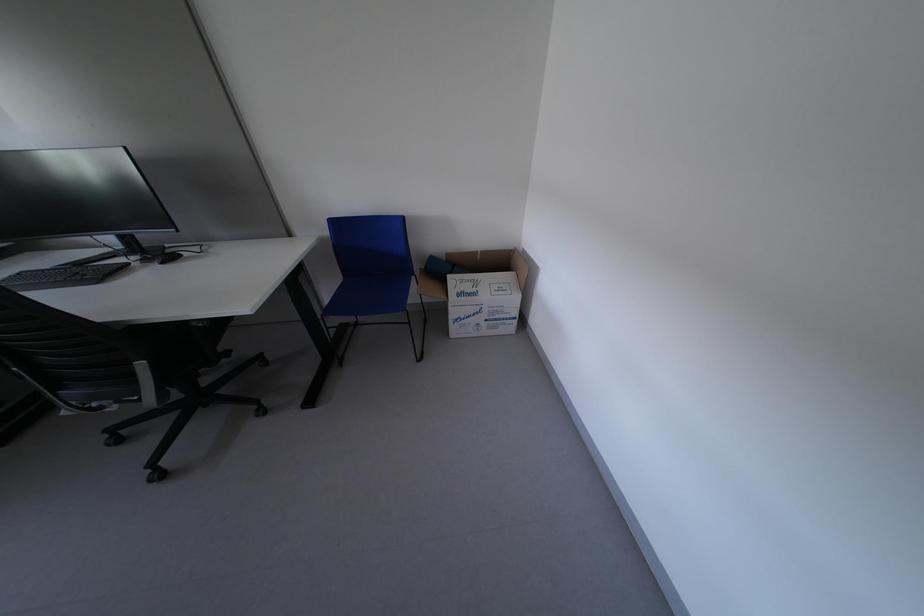
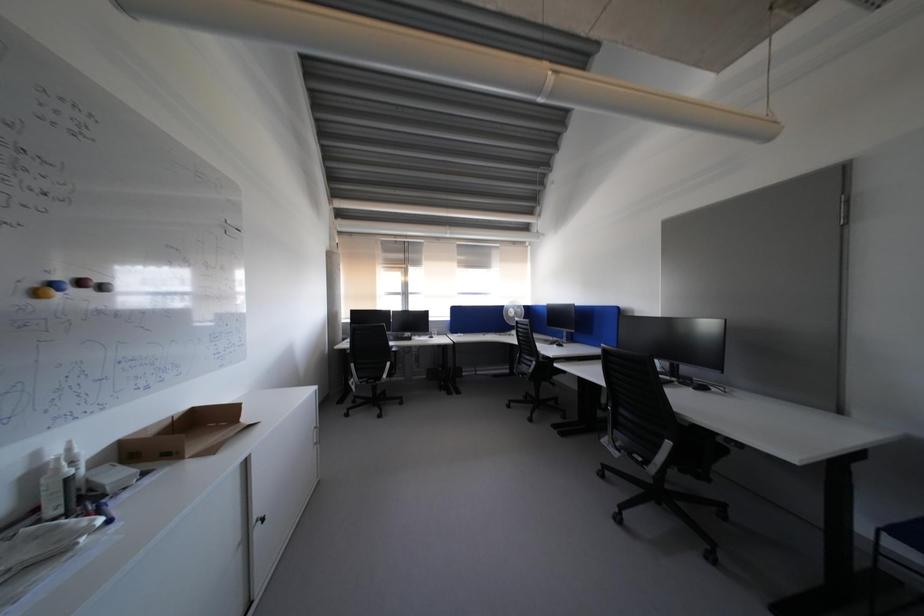
Question: The first image is from the beginning of the video and the second image is from the end. How did the camera likely rotate when shooting the video?

Choices:
 (A) Left
 (B) Right
 (C) Up
 (D) Down

Answer: (A)